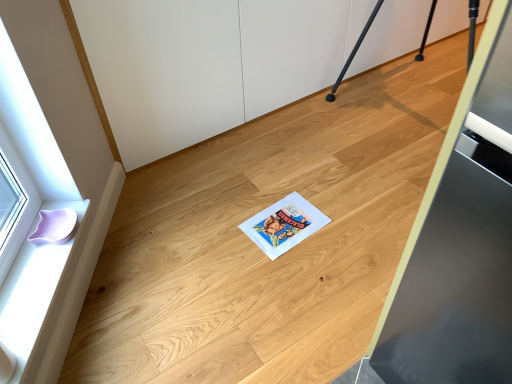
Find the location of a particular element. The height and width of the screenshot is (384, 512). vacant space behind white paper comic book at center is located at coordinates (278, 185).